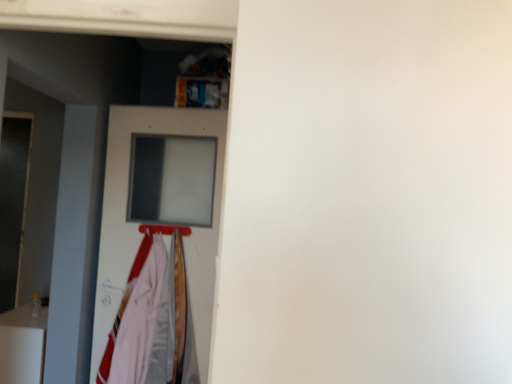
Question: Is metallic silver hanger at center to the right of white fabric at left from the viewer's perspective?

Choices:
 (A) no
 (B) yes

Answer: (B)

Question: Is metallic silver hanger at center with white fabric at left?

Choices:
 (A) no
 (B) yes

Answer: (A)

Question: Is metallic silver hanger at center bigger than white fabric at left?

Choices:
 (A) no
 (B) yes

Answer: (A)

Question: From a real-world perspective, is metallic silver hanger at center under white fabric at left?

Choices:
 (A) no
 (B) yes

Answer: (A)

Question: Is metallic silver hanger at center positioned beyond the bounds of white fabric at left?

Choices:
 (A) no
 (B) yes

Answer: (B)

Question: Is metallic silver hanger at center facing towards white fabric at left?

Choices:
 (A) no
 (B) yes

Answer: (A)

Question: Would you say white glossy fridge at lower left is a long distance from white fabric at left?

Choices:
 (A) yes
 (B) no

Answer: (B)

Question: Is white glossy fridge at lower left at the left side of white fabric at left?

Choices:
 (A) yes
 (B) no

Answer: (A)

Question: Considering the relative sizes of white glossy fridge at lower left and white fabric at left in the image provided, is white glossy fridge at lower left thinner than white fabric at left?

Choices:
 (A) yes
 (B) no

Answer: (B)

Question: Is white glossy fridge at lower left in contact with white fabric at left?

Choices:
 (A) no
 (B) yes

Answer: (A)

Question: Considering the relative sizes of white glossy fridge at lower left and white fabric at left in the image provided, is white glossy fridge at lower left taller than white fabric at left?

Choices:
 (A) no
 (B) yes

Answer: (A)

Question: Is white glossy fridge at lower left facing away from white fabric at left?

Choices:
 (A) no
 (B) yes

Answer: (B)

Question: Are white fabric at left and white glossy fridge at lower left located far from each other?

Choices:
 (A) yes
 (B) no

Answer: (B)